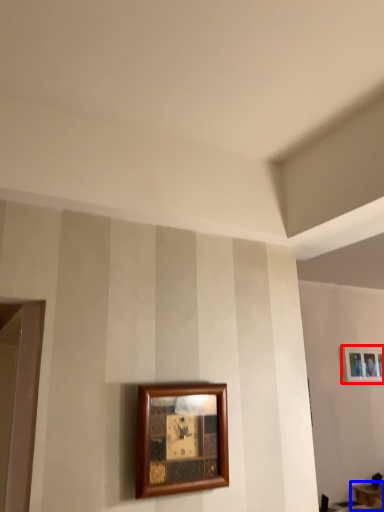
Question: Which of the following is the farthest to the observer, picture frame (highlighted by a red box) or table (highlighted by a blue box)?

Choices:
 (A) picture frame
 (B) table

Answer: (A)